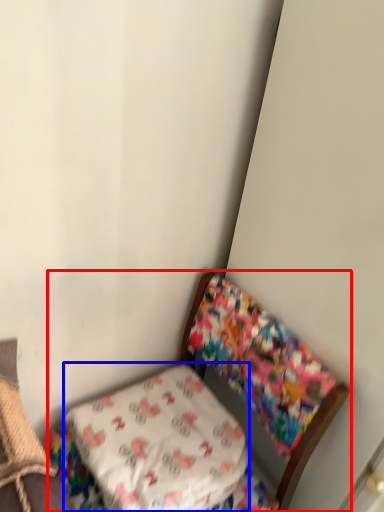
Question: Which point is further to the camera, furniture (highlighted by a red box) or pillow (highlighted by a blue box)?

Choices:
 (A) furniture
 (B) pillow

Answer: (B)